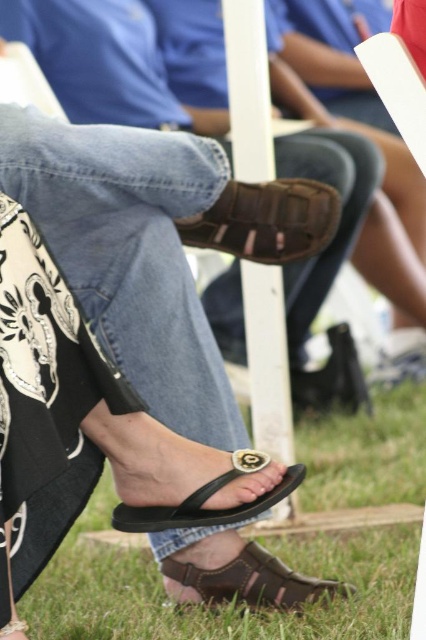
Which is more to the right, green grass at lower center or black leather sandal at lower center?

Positioned to the right is green grass at lower center.

Is green grass at lower center below black leather sandal at lower center?

Incorrect, green grass at lower center is not positioned below black leather sandal at lower center.

Between point (83, 602) and point (20, 628), which one is positioned behind?

The point (83, 602) is more distant.

Image resolution: width=426 pixels, height=640 pixels. Find the location of `green grass at lower center`. green grass at lower center is located at coordinates (264, 545).

Between point (313, 595) and point (3, 628), which one is positioned in front?

Point (3, 628) is in front.

Identify the location of brown leather sandal at lower center. (253, 580).

Who is positioned more to the right, brown leather sandal at lower center or black rubber sandal at lower center?

brown leather sandal at lower center

Is brown leather sandal at lower center positioned before black rubber sandal at lower center?

No, brown leather sandal at lower center is behind black rubber sandal at lower center.

This screenshot has height=640, width=426. I want to click on brown leather sandal at lower center, so click(253, 580).

This screenshot has height=640, width=426. What are the coordinates of `brown leather sandal at lower center` in the screenshot? It's located at (253, 580).